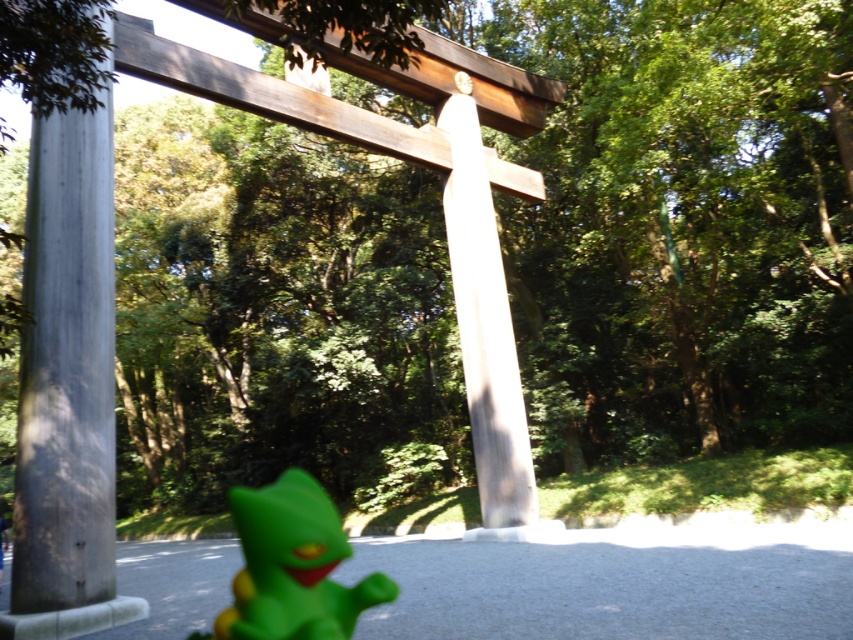
Is point (112, 365) less distant than point (503, 449)?

Yes, point (112, 365) is closer to viewer.

Which is above, smooth gray pole at left or smooth white pillar at center?

smooth gray pole at left is above.

Locate an element on the screen. smooth gray pole at left is located at coordinates [x=68, y=378].

Between smooth white pillar at center and green rubber toy at lower left, which one appears on the right side from the viewer's perspective?

From the viewer's perspective, smooth white pillar at center appears more on the right side.

This screenshot has width=853, height=640. What do you see at coordinates (485, 323) in the screenshot?
I see `smooth white pillar at center` at bounding box center [485, 323].

Locate an element on the screen. Image resolution: width=853 pixels, height=640 pixels. smooth white pillar at center is located at coordinates (485, 323).

Which is more to the right, smooth gray pole at left or green rubber toy at lower left?

From the viewer's perspective, green rubber toy at lower left appears more on the right side.

Can you confirm if smooth gray pole at left is positioned above green rubber toy at lower left?

Indeed, smooth gray pole at left is positioned over green rubber toy at lower left.

Is point (71, 236) more distant than point (299, 579)?

Yes, point (71, 236) is behind point (299, 579).

You are a GUI agent. You are given a task and a screenshot of the screen. Output one action in this format:
    pyautogui.click(x=<x>, y=<y>)
    Task: Click on the smooth gray pole at left
    This screenshot has width=853, height=640.
    Given the screenshot: What is the action you would take?
    pyautogui.click(x=68, y=378)